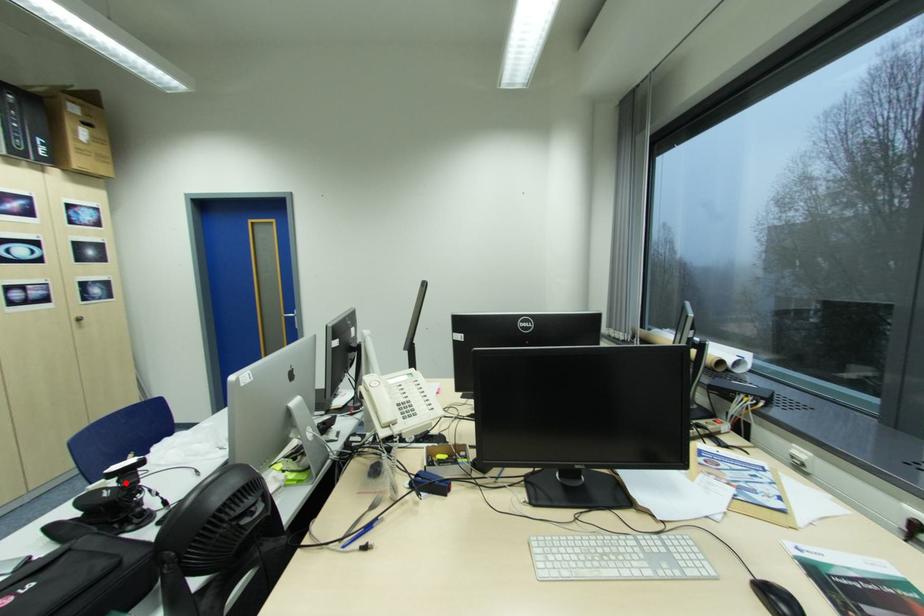
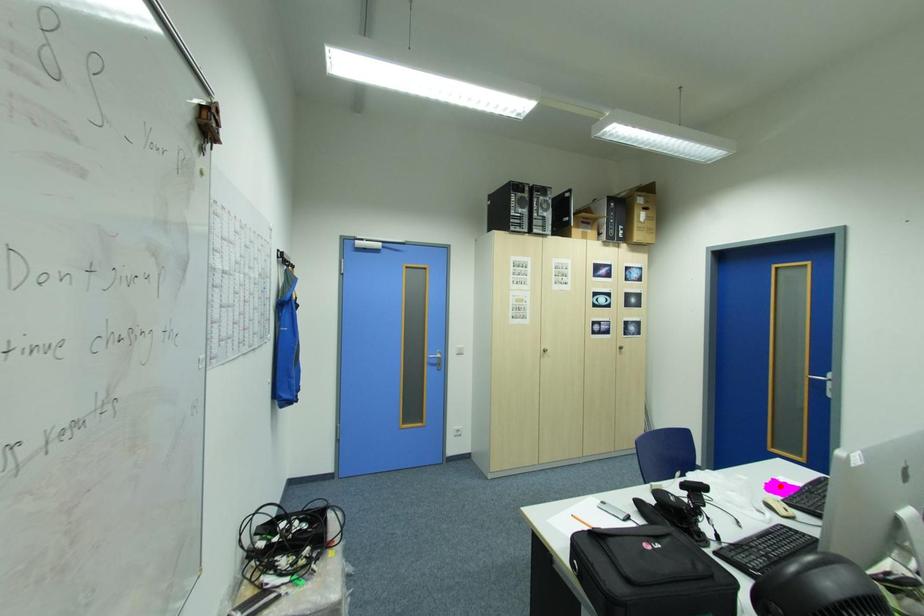
I am providing you with two images of the same scene from different viewpoints. A red point is marked on the first image and another point is marked on the second image. Are the points marked in image1 and image2 representing the same 3D position?

No